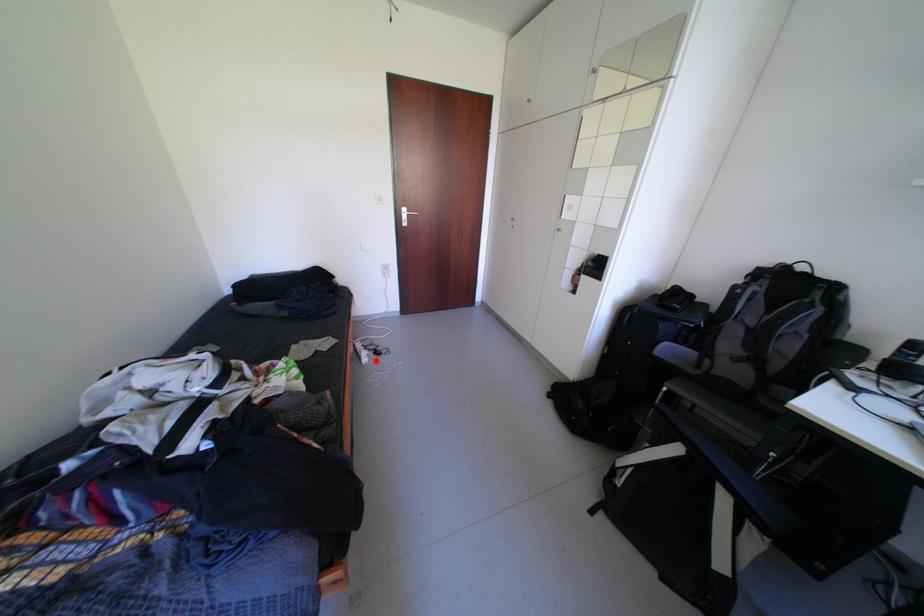
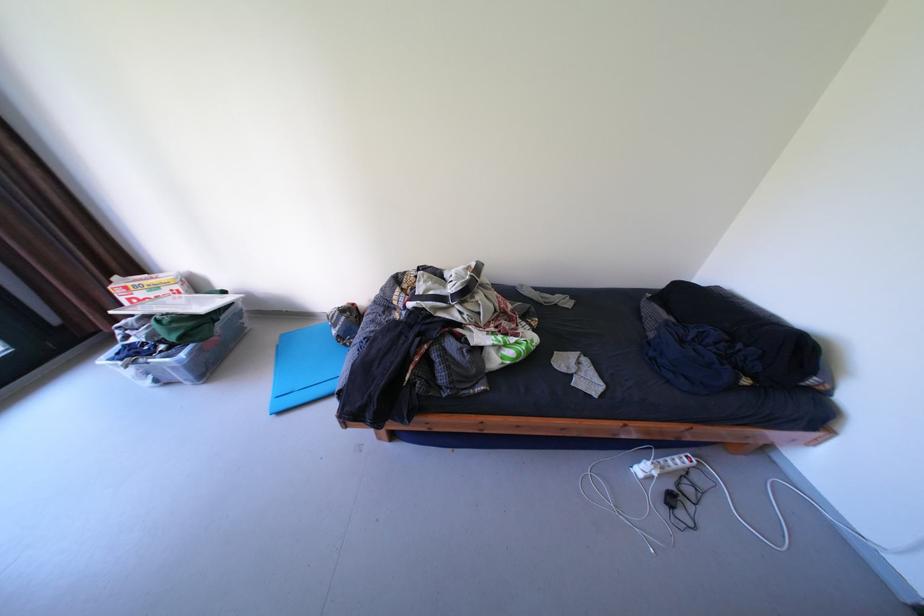
Question: I am providing you with two images of the same scene from different viewpoints. In image1, a red point is highlighted. Considering the same 3D point in image2, which of the following is correct?

Choices:
 (A) It is closer
 (B) It is farther

Answer: (B)